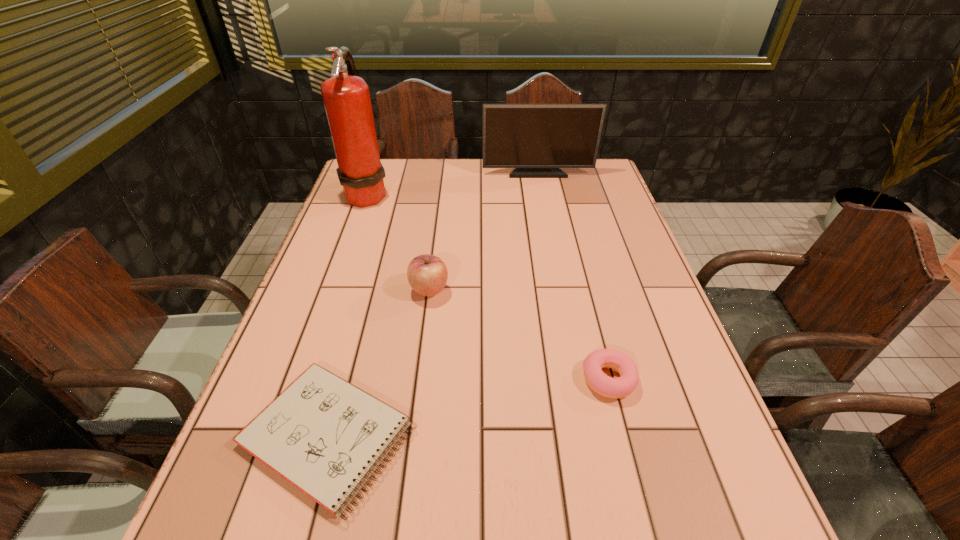
This screenshot has width=960, height=540. I want to click on free space that satisfies the following two spatial constraints: 1. on the back side of the notepad; 2. on the left side of the third shortest object, so click(368, 290).

Where is `free space that satisfies the following two spatial constraints: 1. at the nozzle of the fire extinguisher; 2. on the right side of the third nearest object`? The height and width of the screenshot is (540, 960). free space that satisfies the following two spatial constraints: 1. at the nozzle of the fire extinguisher; 2. on the right side of the third nearest object is located at coordinates (332, 290).